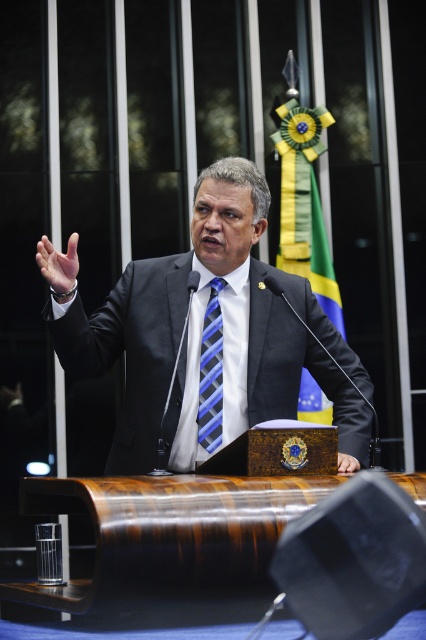
You are a photographer adjusting the camera focus. The camera can only focus on objects with a size larger than 10cm. Based on the scene, will the matte blue tie at center or the smooth skin hand at center be in focus?

The matte blue tie at center has a larger size compared to the smooth skin hand at center. Since the camera focuses on objects larger than 10cm, the matte blue tie at center will be in focus.

You are a photographer taking a portrait of the speaker. You want to ensure that both the matte blue tie at center and the smooth skin hand at center are clearly visible in the photo. Based on their positions, which object should you focus on first to ensure both are in focus?

The matte blue tie at center is above the smooth skin hand at center, so focusing on the matte blue tie at center first will ensure both are in focus since it is closer to the camera.

You are an event photographer positioned at the back of the room. You want to capture a clear photo of the matte blue tie at center without the black suit at center blocking it. Is this possible given their positions?

The black suit at center is further to the viewer than matte blue tie at center, so the black suit at center is closer to the photographer. This means the black suit at center would block the view of the matte blue tie at center, making it impossible to capture a clear photo of the matte blue tie at center without the black suit at center blocking it.